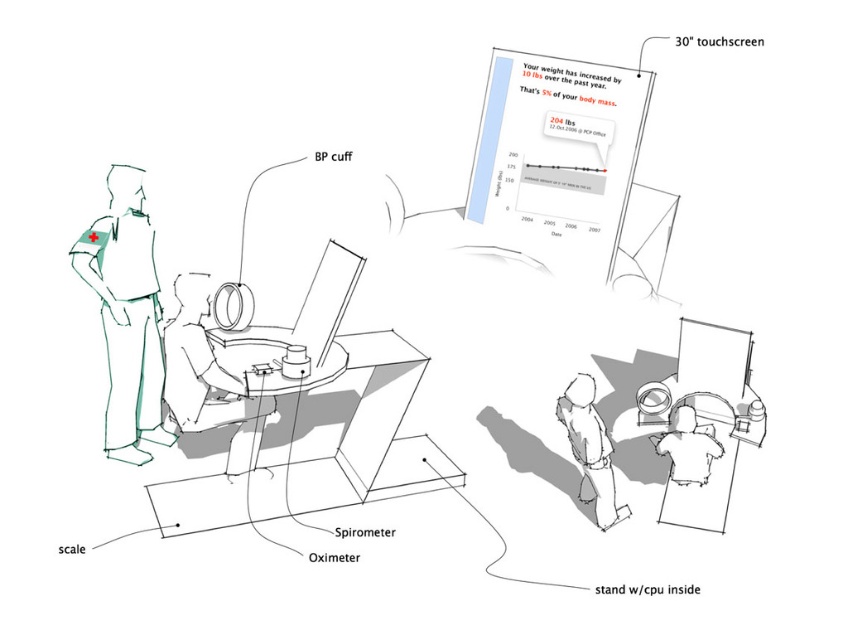
Where is the matte black monitor at center located?

The matte black monitor at center is located at point 0.592 on the x axis and point 0.246 on the y axis.

You are a patient in the consultation room and want to reach the healthcare professional standing at point (x=700, y=476). However, there is an obstacle at point (x=112, y=216). Can you walk directly to the healthcare professional without going around the obstacle?

The point (x=112, y=216) is further to the camera than point (x=700, y=476). This means the obstacle at point (x=112, y=216) is closer to you, blocking the direct path to the healthcare professional at (x=700, y=476). Therefore, you would need to go around the obstacle to reach them.

You are a patient in a consultation room and see the green fabric shirt at left and the white glossy shirt at center. Which healthcare professional is closer to the desk where the medical devices are located?

The white glossy shirt at center is closer to the desk where the medical devices are located because it is positioned at the center, while the green fabric shirt at left is to the left of it.